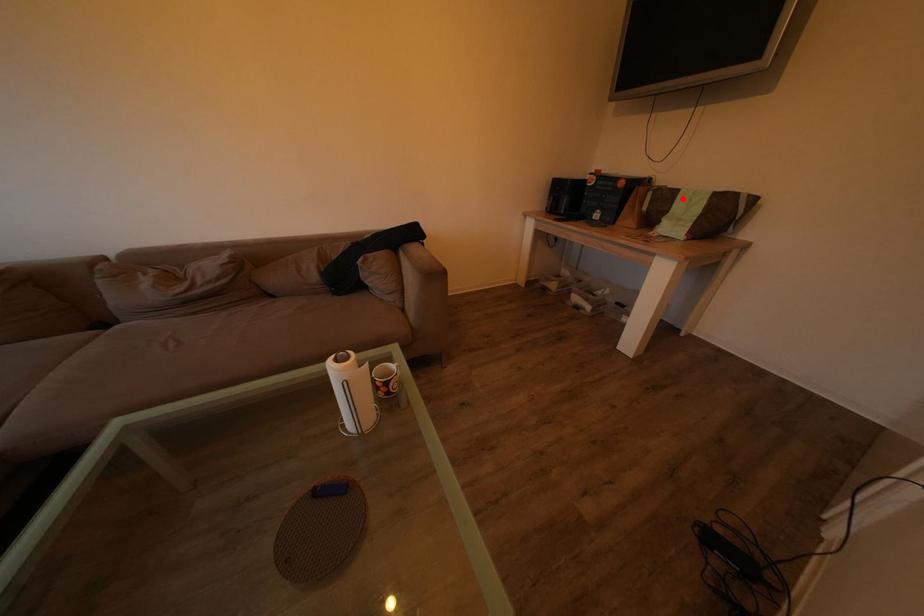
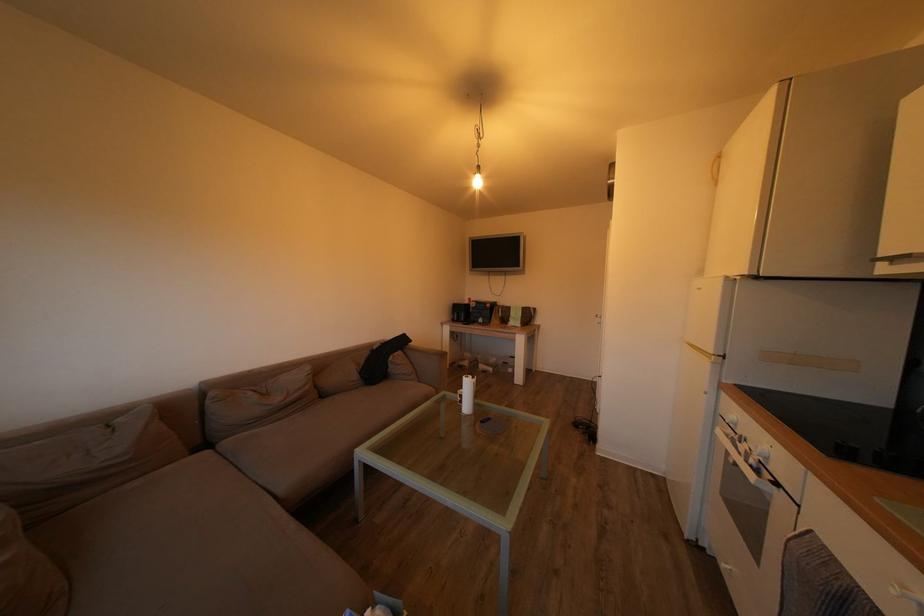
Find the pixel in the second image that matches the highlighted location in the first image.

(517, 314)